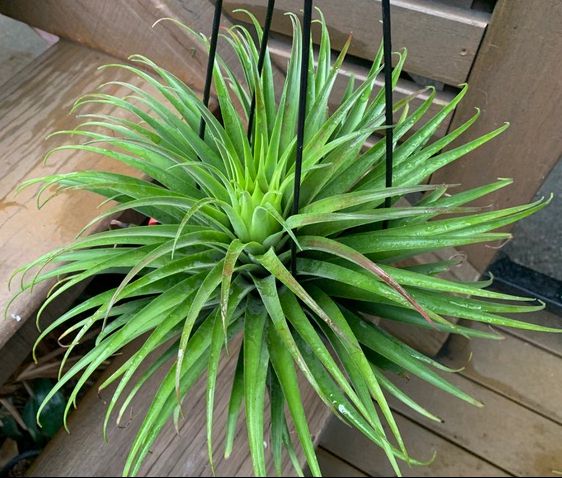
At what (x,y) coordinates should I click in order to perform the action: click on plant. Please return your answer as a coordinate pair (x, y). The height and width of the screenshot is (478, 562). Looking at the image, I should click on (276, 207).